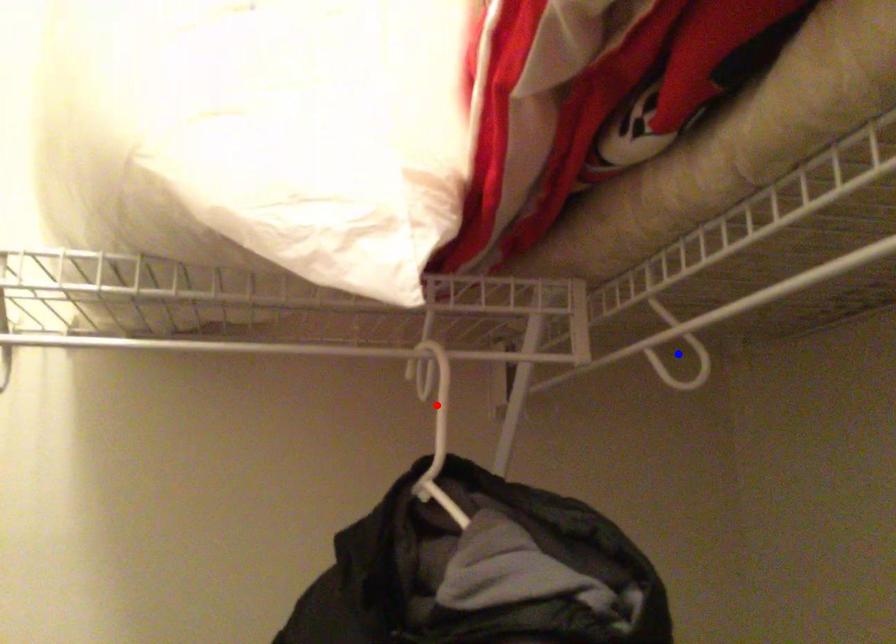
Question: In the image, two points are highlighted. Which point is nearer to the camera? Reply with the corresponding letter.

Choices:
 (A) blue point
 (B) red point

Answer: (B)